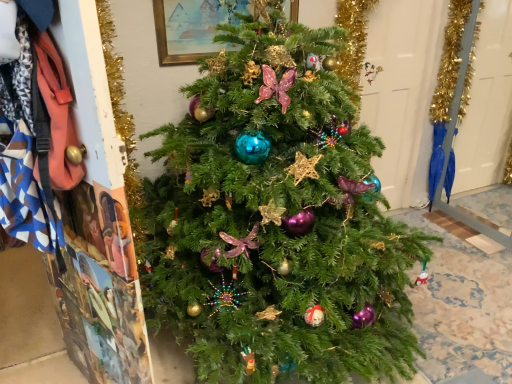
Describe the element at coordinates (277, 219) in the screenshot. This screenshot has height=384, width=512. I see `green matte christmas tree at center` at that location.

What is the approximate height of green matte christmas tree at center?

green matte christmas tree at center is 1.54 meters in height.

Locate an element on the screen. The height and width of the screenshot is (384, 512). green matte christmas tree at center is located at coordinates (277, 219).

The width and height of the screenshot is (512, 384). I want to click on green matte christmas tree at center, so click(x=277, y=219).